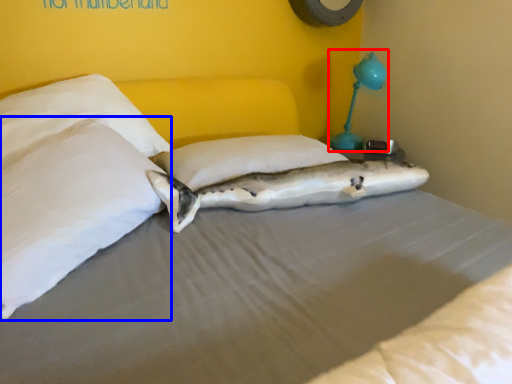
Question: Which point is further to the camera, table lamp (highlighted by a red box) or pillow (highlighted by a blue box)?

Choices:
 (A) table lamp
 (B) pillow

Answer: (A)